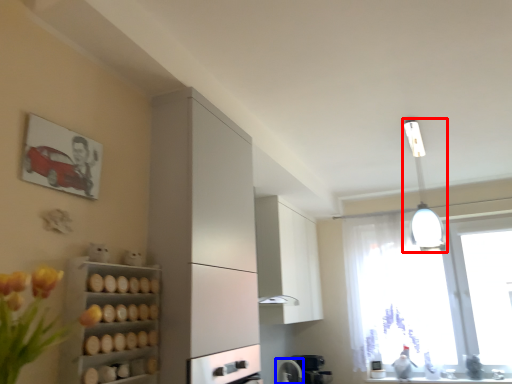
Question: Which point is closer to the camera, light fixture (highlighted by a red box) or appliance (highlighted by a blue box)?

Choices:
 (A) light fixture
 (B) appliance

Answer: (A)